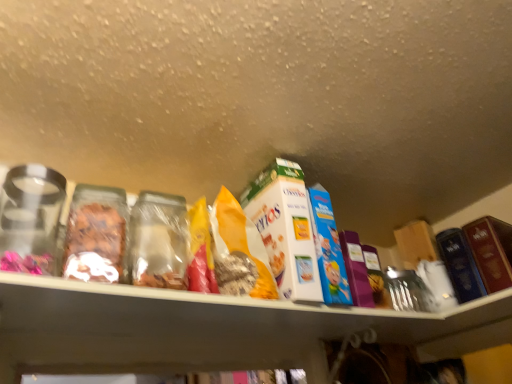
Question: Does white cardboard cereal box at center, which appears as the 2th product when viewed from the right, lie behind hardcover book at right, marked as the 1th product in a right-to-left arrangement?

Choices:
 (A) yes
 (B) no

Answer: (B)

Question: Considering the relative sizes of white cardboard cereal box at center, which appears as the 2th product when viewed from the right, and hardcover book at right, acting as the 2th product starting from the left, in the image provided, is white cardboard cereal box at center, which appears as the 2th product when viewed from the right, smaller than hardcover book at right, acting as the 2th product starting from the left,?

Choices:
 (A) yes
 (B) no

Answer: (B)

Question: Is white cardboard cereal box at center, which appears as the 2th product when viewed from the right, thinner than hardcover book at right, marked as the 1th product in a right-to-left arrangement?

Choices:
 (A) no
 (B) yes

Answer: (A)

Question: Considering the relative positions of white cardboard cereal box at center, which appears as the 2th product when viewed from the right, and hardcover book at right, acting as the 2th product starting from the left, in the image provided, is white cardboard cereal box at center, which appears as the 2th product when viewed from the right, to the right of hardcover book at right, acting as the 2th product starting from the left, from the viewer's perspective?

Choices:
 (A) yes
 (B) no

Answer: (B)

Question: Considering the relative sizes of white cardboard cereal box at center, which is counted as the first product, starting from the left, and hardcover book at right, marked as the 1th product in a right-to-left arrangement, in the image provided, is white cardboard cereal box at center, which is counted as the first product, starting from the left, bigger than hardcover book at right, marked as the 1th product in a right-to-left arrangement,?

Choices:
 (A) no
 (B) yes

Answer: (B)

Question: From the image's perspective, does white cardboard cereal box at center, which is counted as the first product, starting from the left, appear higher than hardcover book at right, marked as the 1th product in a right-to-left arrangement?

Choices:
 (A) yes
 (B) no

Answer: (A)

Question: Is hardcover book at right, marked as the 1th product in a right-to-left arrangement, wider than white cardboard cereal box at center, which appears as the 2th product when viewed from the right?

Choices:
 (A) yes
 (B) no

Answer: (B)

Question: Does hardcover book at right, marked as the 1th product in a right-to-left arrangement, have a greater height compared to white cardboard cereal box at center, which appears as the 2th product when viewed from the right?

Choices:
 (A) yes
 (B) no

Answer: (B)

Question: Can white cardboard cereal box at center, which is counted as the first product, starting from the left, be found inside hardcover book at right, marked as the 1th product in a right-to-left arrangement?

Choices:
 (A) no
 (B) yes

Answer: (A)

Question: Is hardcover book at right, acting as the 2th product starting from the left, beside white cardboard cereal box at center, which is counted as the first product, starting from the left?

Choices:
 (A) no
 (B) yes

Answer: (A)

Question: Considering the relative sizes of hardcover book at right, acting as the 2th product starting from the left, and white cardboard cereal box at center, which is counted as the first product, starting from the left, in the image provided, is hardcover book at right, acting as the 2th product starting from the left, smaller than white cardboard cereal box at center, which is counted as the first product, starting from the left,?

Choices:
 (A) yes
 (B) no

Answer: (A)

Question: From a real-world perspective, is hardcover book at right, acting as the 2th product starting from the left, beneath white cardboard cereal box at center, which appears as the 2th product when viewed from the right?

Choices:
 (A) yes
 (B) no

Answer: (A)

Question: Does hardcover book at right, acting as the 2th product starting from the left, touch yellow paper bag at center?

Choices:
 (A) no
 (B) yes

Answer: (A)